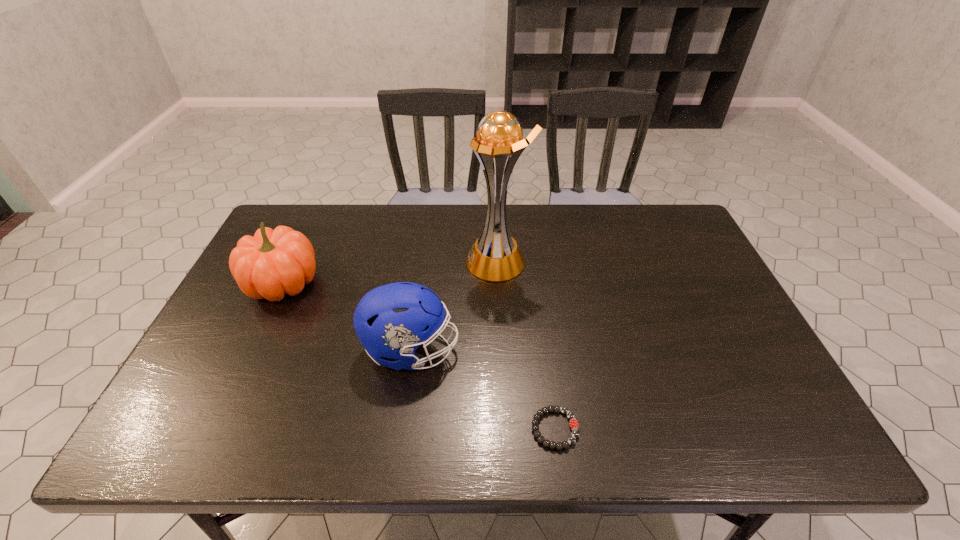
At what (x,y) coordinates should I click in order to perform the action: click on trophy. Please return your answer as a coordinate pair (x, y). The width and height of the screenshot is (960, 540). Looking at the image, I should click on (495, 256).

Locate an element on the screen. Image resolution: width=960 pixels, height=540 pixels. pumpkin is located at coordinates (273, 263).

At what (x,y) coordinates should I click in order to perform the action: click on football helmet. Please return your answer as a coordinate pair (x, y). The height and width of the screenshot is (540, 960). Looking at the image, I should click on (391, 321).

Where is `the third object from right to left`? The width and height of the screenshot is (960, 540). the third object from right to left is located at coordinates (391, 321).

Find the location of a particular element. the shortest object is located at coordinates (573, 422).

Where is `the nearest object`? This screenshot has width=960, height=540. the nearest object is located at coordinates (573, 422).

Identify the location of free space located 0.390m on the front-facing side of the tallest object. (338, 261).

What are the coordinates of `vacant space located on the front-facing side of the tallest object` in the screenshot? It's located at (381, 261).

This screenshot has height=540, width=960. In order to click on vacant space located on the front-facing side of the tallest object in this screenshot , I will do `click(348, 261)`.

You are a GUI agent. You are given a task and a screenshot of the screen. Output one action in this format:
    pyautogui.click(x=<x>, y=<y>)
    Task: Click on the free space located 0.290m on the front of the leftmost object
    
    Given the screenshot: What is the action you would take?
    pyautogui.click(x=225, y=408)